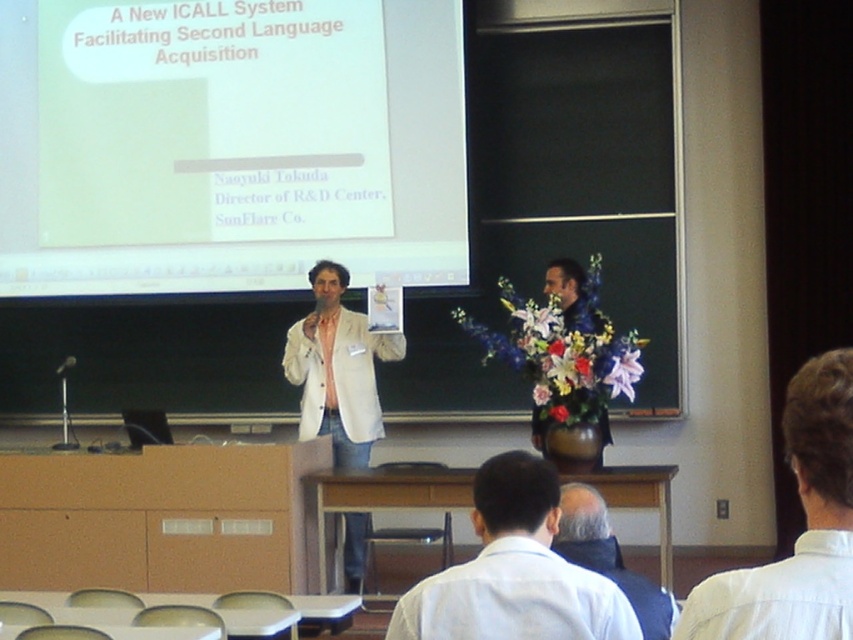
You are an event organizer and need to ensure that the two presenters at the podium have enough space to move comfortably. Based on the image, which presenter is wearing a wider garment, the white shirt at lower center or the dark blue jacket at lower center?

The white shirt at lower center might be wider than dark blue jacket at lower center, so the presenter wearing the white shirt at lower center has a wider garment and may require more space.